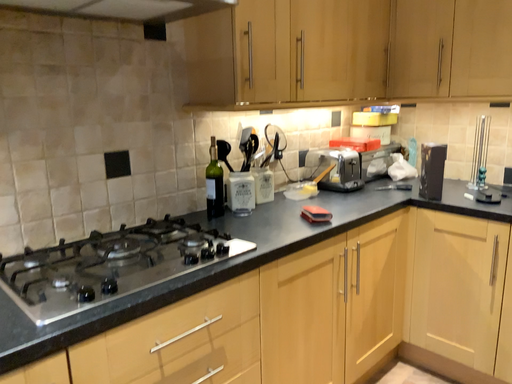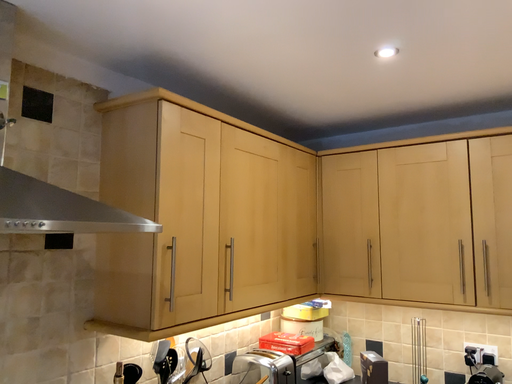
Question: Which way did the camera rotate in the video?

Choices:
 (A) rotated right
 (B) rotated left

Answer: (A)